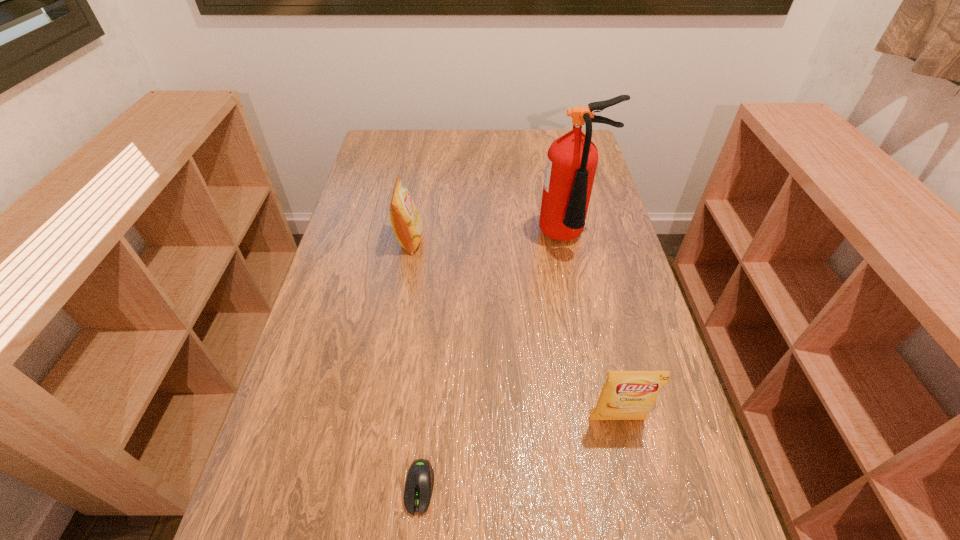
Identify the location of fire extinguisher situated at the right edge. The image size is (960, 540). (572, 159).

At what (x,y) coordinates should I click in order to perform the action: click on crisp (potato chip) at the right edge. Please return your answer as a coordinate pair (x, y). This screenshot has height=540, width=960. Looking at the image, I should click on (626, 395).

Image resolution: width=960 pixels, height=540 pixels. Identify the location of vacant space at the far edge of the desktop. (456, 159).

The image size is (960, 540). What are the coordinates of `vacant space at the left edge of the desktop` in the screenshot? It's located at (307, 539).

Where is `vacant space at the right edge`? The height and width of the screenshot is (540, 960). vacant space at the right edge is located at coordinates 581,261.

The image size is (960, 540). Find the location of `vacant space at the far right corner of the desktop`. vacant space at the far right corner of the desktop is located at coordinates (584, 130).

The height and width of the screenshot is (540, 960). I want to click on free space between the third farthest object and the shortest object, so click(518, 454).

You are a GUI agent. You are given a task and a screenshot of the screen. Output one action in this format:
    pyautogui.click(x=<x>, y=<y>)
    Task: Click on the free space between the second object from left to right and the tallest object
    This screenshot has height=540, width=960.
    Given the screenshot: What is the action you would take?
    pyautogui.click(x=494, y=363)

Where is `vacant space that's between the third object from right to left and the farther crisp (potato chip)`? This screenshot has height=540, width=960. vacant space that's between the third object from right to left and the farther crisp (potato chip) is located at coordinates (415, 364).

You are a GUI agent. You are given a task and a screenshot of the screen. Output one action in this format:
    pyautogui.click(x=<x>, y=<y>)
    Task: Click on the free space between the fire extinguisher and the shortest object
    
    Given the screenshot: What is the action you would take?
    (x=494, y=363)